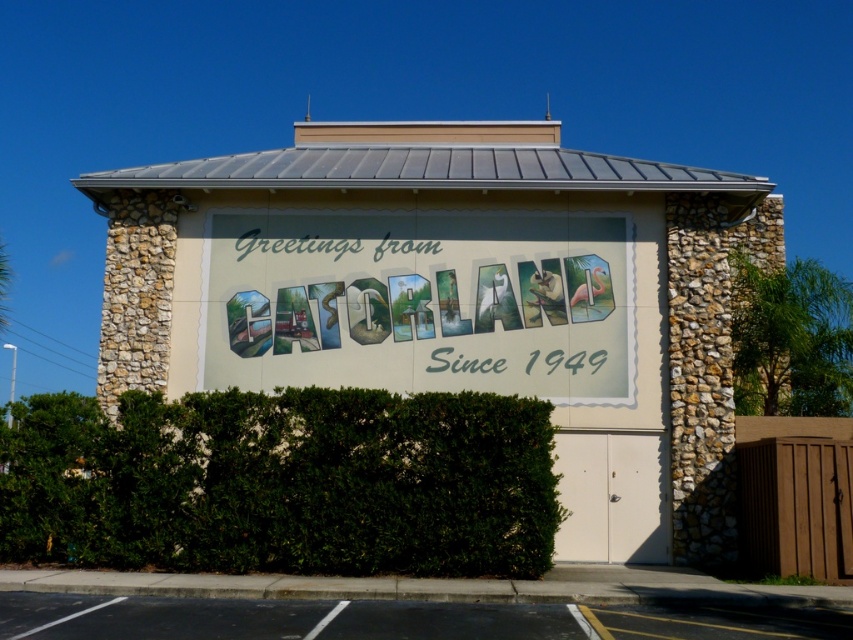
Can you confirm if green leafy hedge at lower center is positioned below black asphalt at lower center?

No.

Is point (126, 403) farther from camera compared to point (335, 634)?

Yes, point (126, 403) is farther from viewer.

Who is more distant from viewer, (x=526, y=433) or (x=534, y=618)?

Point (x=526, y=433)

Where is `green leafy hedge at lower center`? green leafy hedge at lower center is located at coordinates (282, 483).

Between pastel painted sign at center and black asphalt at lower center, which one is positioned higher?

pastel painted sign at center

Who is lower down, pastel painted sign at center or black asphalt at lower center?

black asphalt at lower center is below.

Is point (201, 348) closer to viewer compared to point (88, 600)?

That is False.

Identify the location of pastel painted sign at center. (421, 301).

Is green leafy hedge at lower center taller than pastel painted sign at center?

Yes.

Measure the distance between green leafy hedge at lower center and camera.

The distance of green leafy hedge at lower center from camera is 12.70 meters.

Who is more forward, (262, 528) or (322, 333)?

Point (262, 528)

Image resolution: width=853 pixels, height=640 pixels. Find the location of `green leafy hedge at lower center`. green leafy hedge at lower center is located at coordinates (282, 483).